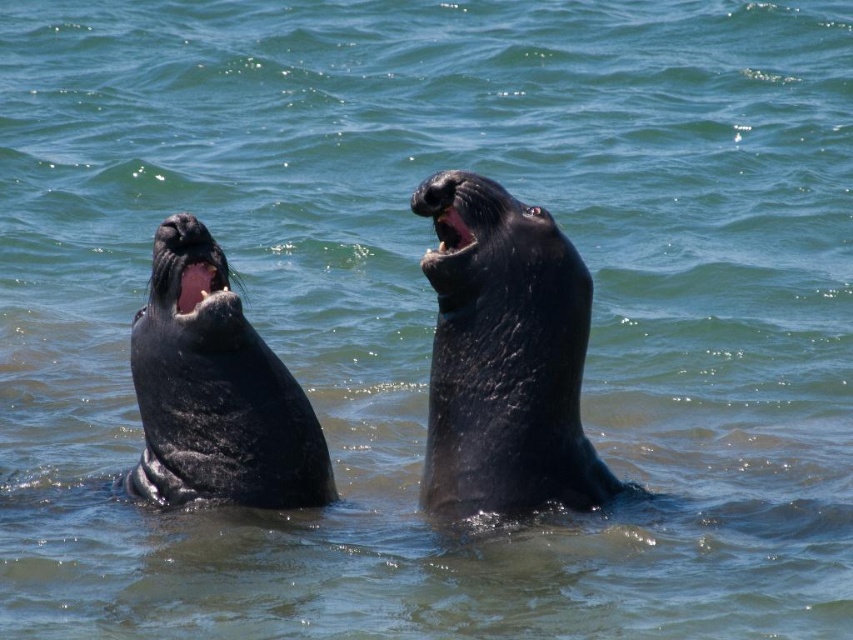
You are a marine biologist observing the seals in the image. You notice the shiny black seal at center and the black matte seal mouth at upper center. Which object is positioned higher in the image?

The black matte seal mouth at upper center is positioned higher in the image than the shiny black seal at center.

You are a marine biologist observing the two seals in the water. You notice the shiny black seal at center and the black matte seal mouth at upper center. Which seal is located to the left of the other?

The shiny black seal at center is positioned on the right side of black matte seal mouth at upper center, so the black matte seal mouth at upper center is to the left of the shiny black seal at center.

You are a marine biologist observing two seals in the water. You notice the shiny black seal at left and the black matte seal mouth at upper center. Which seal is positioned lower in the water?

The shiny black seal at left is located below the black matte seal mouth at upper center, so it is positioned lower in the water.